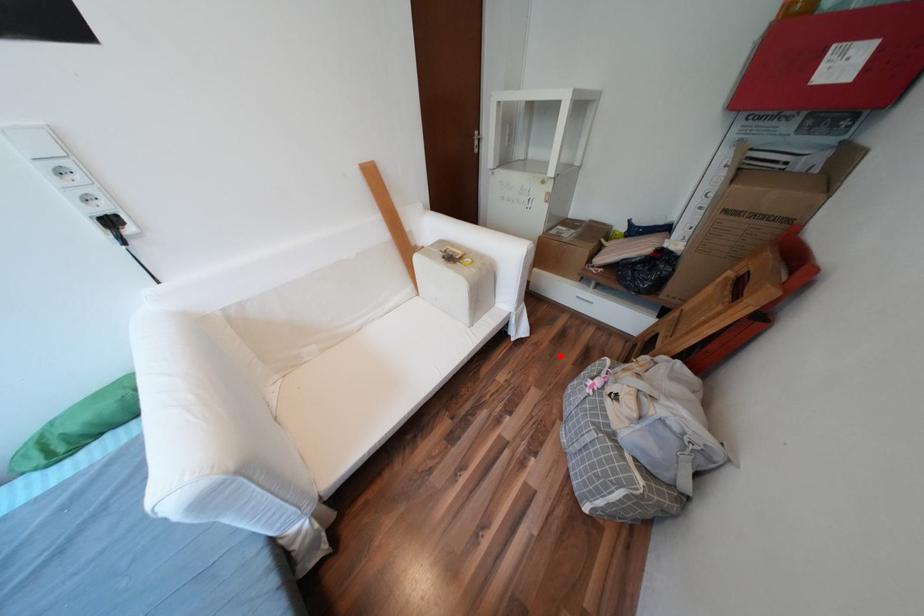
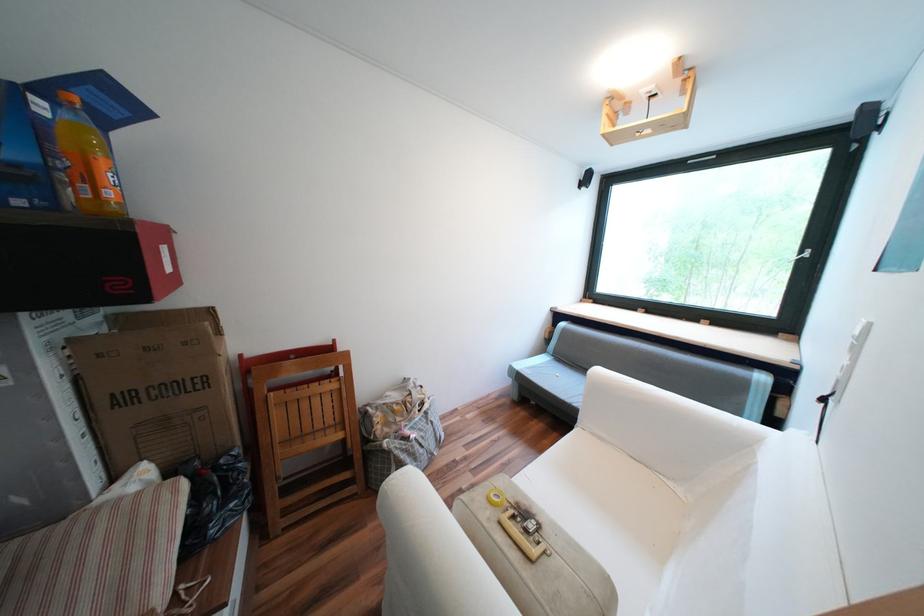
Question: I am providing you with two images of the same scene from different viewpoints. Image1 has a red point marked. In image2, the corresponding 3D location appears at what relative position? Reply with the corresponding letter.

Choices:
 (A) Closer
 (B) Farther

Answer: (B)